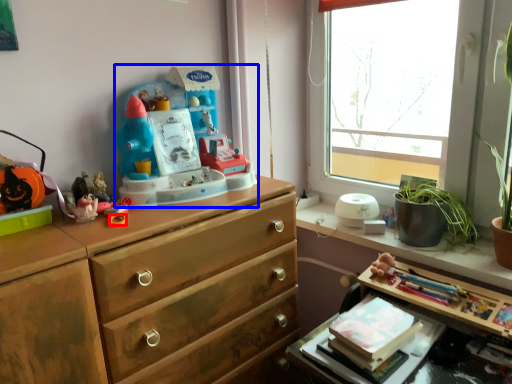
Question: Which point is closer to the camera, knob (highlighted by a red box) or toy (highlighted by a blue box)?

Choices:
 (A) knob
 (B) toy

Answer: (B)